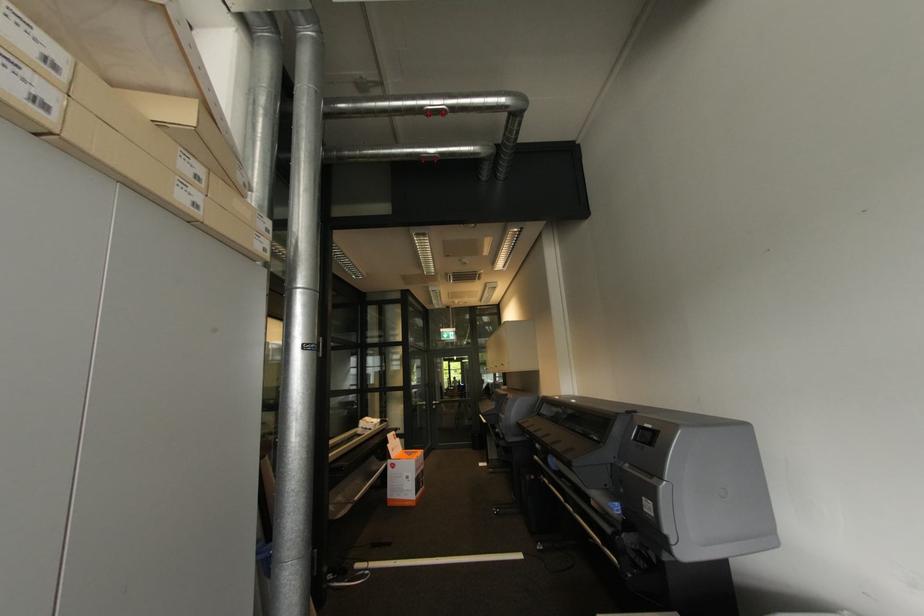
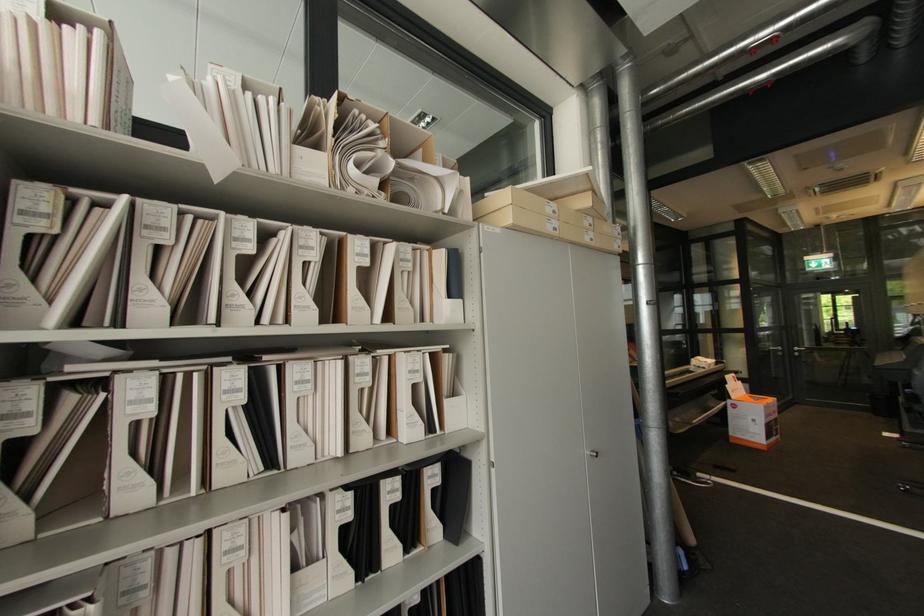
Locate, in the second image, the point that corresponds to point 393,505 in the first image.

(736, 442)